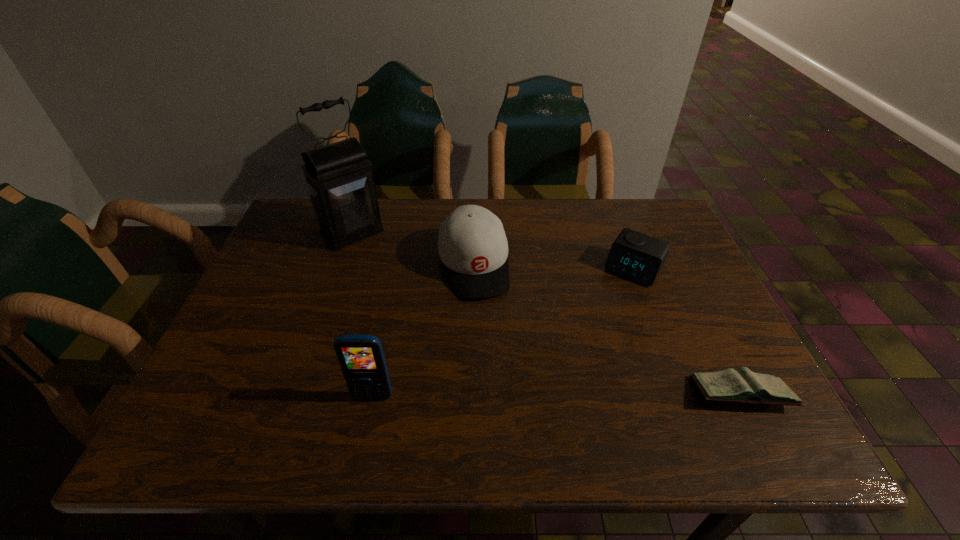
Locate an element on the screen. This screenshot has width=960, height=540. vacant point located 0.270m on the front-facing side of the alarm clock is located at coordinates click(577, 356).

The image size is (960, 540). In order to click on vacant space situated 0.270m on the front-facing side of the alarm clock in this screenshot , I will do `click(577, 356)`.

The height and width of the screenshot is (540, 960). Find the location of `vacant region located on the front-facing side of the third tallest object`. vacant region located on the front-facing side of the third tallest object is located at coordinates (503, 384).

At what (x,y) coordinates should I click in order to perform the action: click on free space located on the front-facing side of the third tallest object. Please return your answer as a coordinate pair (x, y). Looking at the image, I should click on (493, 350).

Find the location of a particular element. vacant space located on the front-facing side of the third tallest object is located at coordinates (498, 368).

Locate an element on the screen. Image resolution: width=960 pixels, height=540 pixels. blank space located 0.330m on the front-facing side of the tallest object is located at coordinates pyautogui.click(x=432, y=317).

The width and height of the screenshot is (960, 540). What are the coordinates of `blank space located 0.320m on the front-facing side of the tallest object` in the screenshot? It's located at (429, 314).

The width and height of the screenshot is (960, 540). What are the coordinates of `free location located 0.060m on the front-facing side of the tallest object` in the screenshot? It's located at (377, 258).

Identify the location of baseball cap that is at the far edge. The height and width of the screenshot is (540, 960). (472, 244).

Locate an element on the screen. The height and width of the screenshot is (540, 960). lantern located at the far edge is located at coordinates (340, 183).